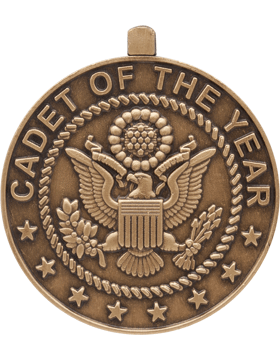
Locate an element on the screen. decorative ring is located at coordinates (206, 266).